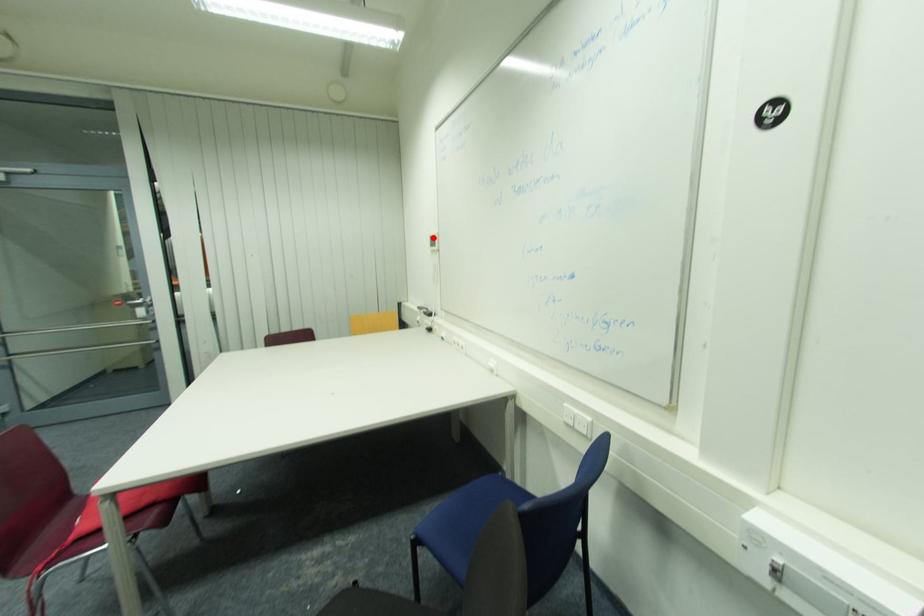
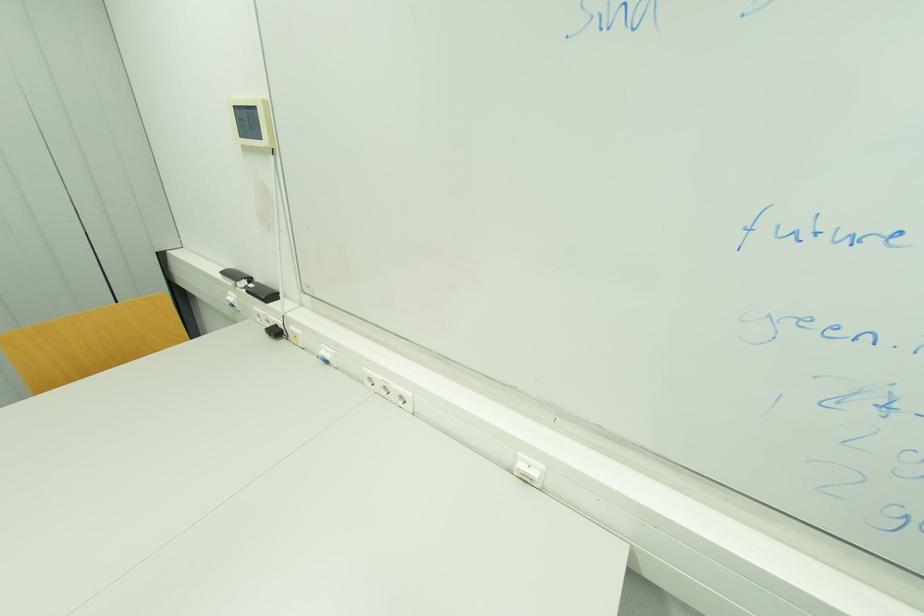
Find the pixel in the second image that matches the highlighted location in the first image.

(237, 108)